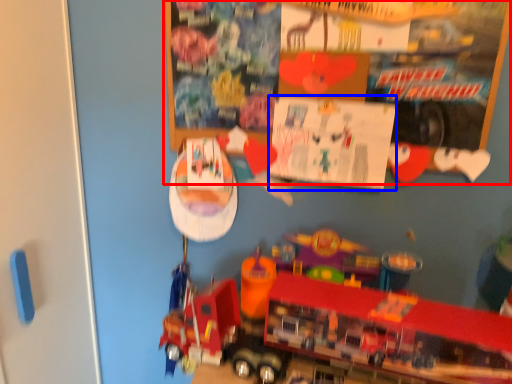
Question: Which of the following is the farthest to the observer, bulletin board (highlighted by a red box) or poster page (highlighted by a blue box)?

Choices:
 (A) bulletin board
 (B) poster page

Answer: (B)